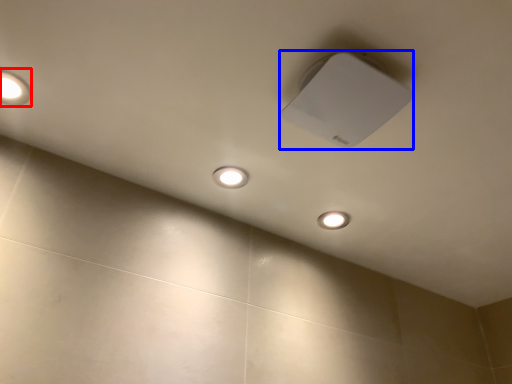
Question: Which of the following is the farthest to the observer, lamp (highlighted by a red box) or lamp (highlighted by a blue box)?

Choices:
 (A) lamp
 (B) lamp

Answer: (A)